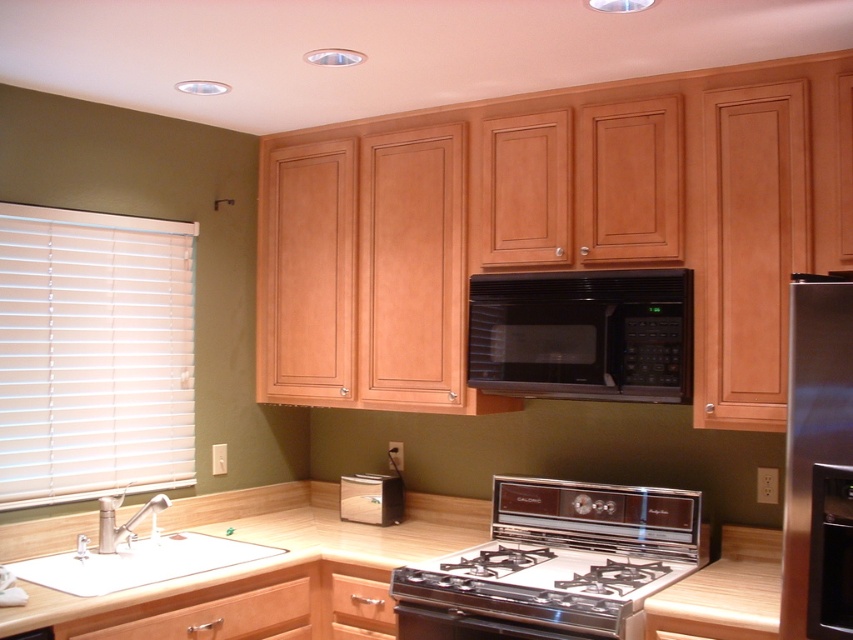
You are organizing a dinner party and need to place a large platter on the surface. Which object from the wooden at lower center and the light brown wood drawer at lower left would be more suitable for placing the platter?

The wooden at lower center has a larger size compared to the light brown wood drawer at lower left, so it would be more suitable for placing the large platter.